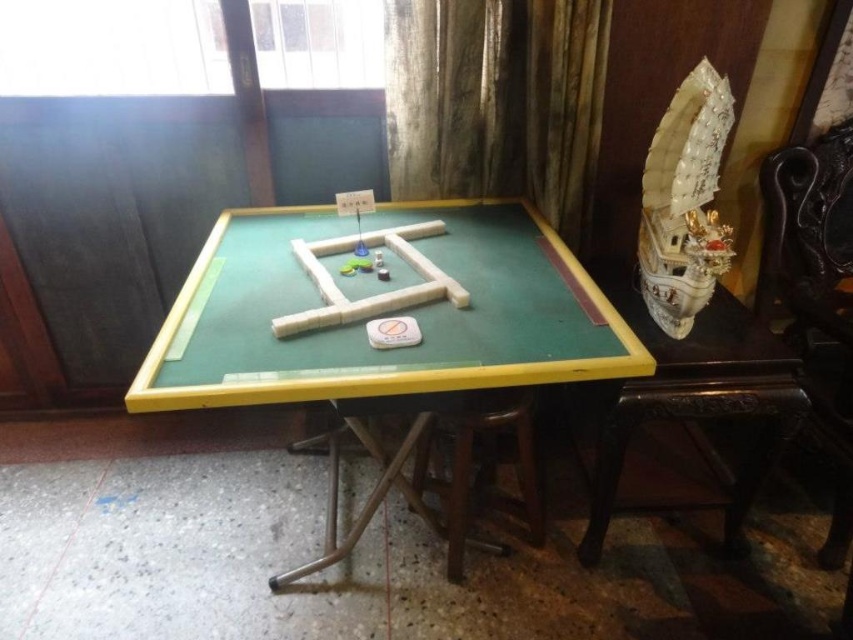
Question: Which object is positioned farthest from the white matte wooden blocks at center?

Choices:
 (A) ivory textured ship at upper right
 (B) wooden stool at lower center

Answer: (A)

Question: Is green felt table at center smaller than white matte wooden blocks at center?

Choices:
 (A) no
 (B) yes

Answer: (A)

Question: Can you confirm if green felt table at center is positioned below wooden stool at lower center?

Choices:
 (A) no
 (B) yes

Answer: (A)

Question: Observing the image, what is the correct spatial positioning of green felt table at center in reference to ivory textured ship at upper right?

Choices:
 (A) above
 (B) below

Answer: (B)

Question: Which of the following is the farthest from the observer?

Choices:
 (A) (666, 116)
 (B) (334, 310)

Answer: (A)

Question: Which object is closer to the camera taking this photo?

Choices:
 (A) wooden stool at lower center
 (B) green felt table at center
 (C) ivory textured ship at upper right
 (D) white matte wooden blocks at center

Answer: (B)